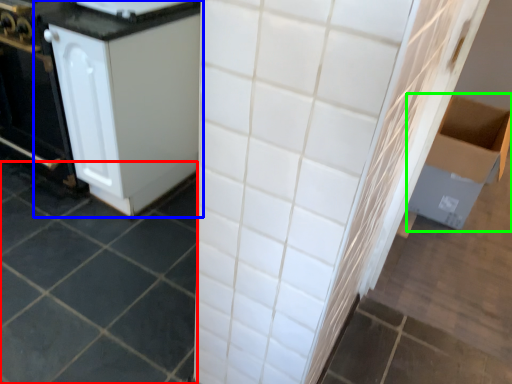
Question: Which is nearer to the ceramic tile (highlighted by a red box)? cabinetry (highlighted by a blue box) or cardboard box (highlighted by a green box).

Choices:
 (A) cabinetry
 (B) cardboard box

Answer: (A)